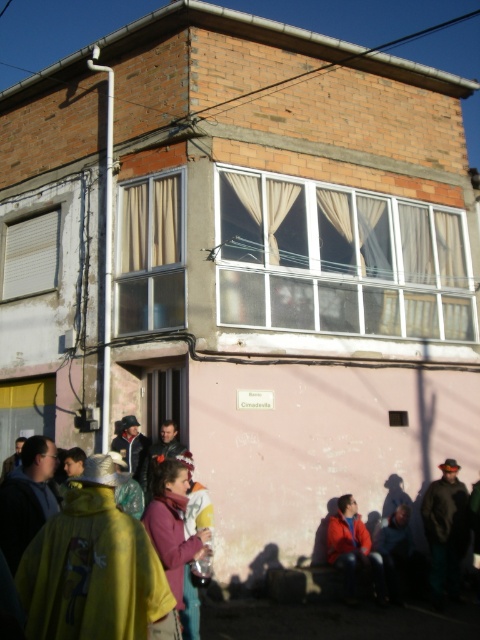
You are a tailor who needs to determine which fabric item requires more material to make between the yellow fabric cape at center and the beige fabric curtain at upper left. Based on the scene, which one would need more fabric?

The yellow fabric cape at center requires more fabric because its width is larger than the beige fabric curtain at upper left.

Based on the photo, you are standing in front of the building and want to locate the point with coordinates (31,256). According to the image, where exactly is this point located?

The point with coordinates (31,256) is on the white matte window at upper left.

You are a delivery person trying to locate the entrance to the building. You notice the white matte window at upper left. Based on its position, can you determine if the entrance is to the left or right of this window?

The entrance is to the right of the white matte window at upper left because the window is positioned at the upper left corner, typically indicating that the entrance is on the opposite side.